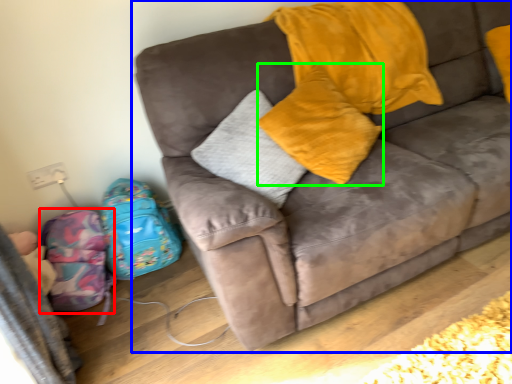
Question: Considering the real-world distances, which object is closest to luggage (highlighted by a red box)? studio couch (highlighted by a blue box) or pillow (highlighted by a green box).

Choices:
 (A) studio couch
 (B) pillow

Answer: (A)